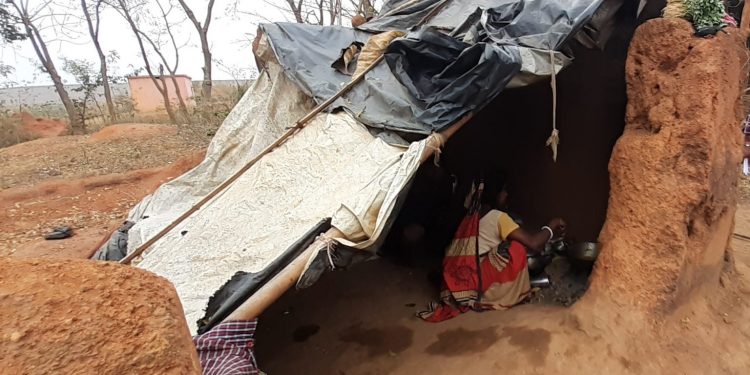
Identify the location of brick wall. The image size is (750, 375). (675, 194).